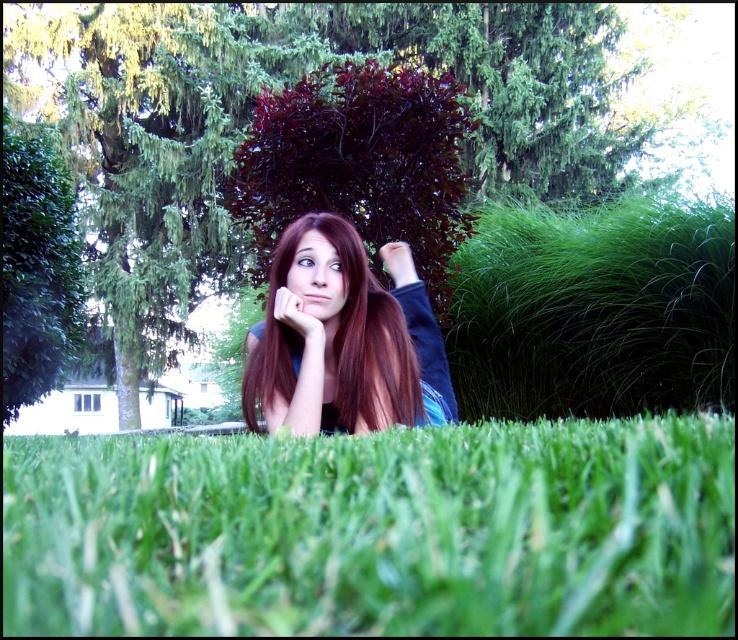
Is shiny brown hair at center to the left of matte skin hand at center from the viewer's perspective?

No, shiny brown hair at center is not to the left of matte skin hand at center.

Can you confirm if shiny brown hair at center is positioned below matte skin hand at center?

Yes.

This screenshot has width=738, height=640. Identify the location of shiny brown hair at center. (341, 340).

Describe the element at coordinates (376, 531) in the screenshot. The width and height of the screenshot is (738, 640). I see `green grass at lower center` at that location.

Can you confirm if green grass at lower center is positioned to the right of shiny brown hair at center?

Incorrect, green grass at lower center is not on the right side of shiny brown hair at center.

Find the location of a particular element. This screenshot has width=738, height=640. green grass at lower center is located at coordinates (376, 531).

Between point (10, 570) and point (406, 268), which one is positioned in front?

Point (10, 570) is in front.

Who is more distant from viewer, (565,445) or (400,244)?

The point (400,244) is behind.

Between point (128, 472) and point (406, 275), which one is positioned in front?

Positioned in front is point (128, 472).

Identify the location of green grass at lower center. (376, 531).